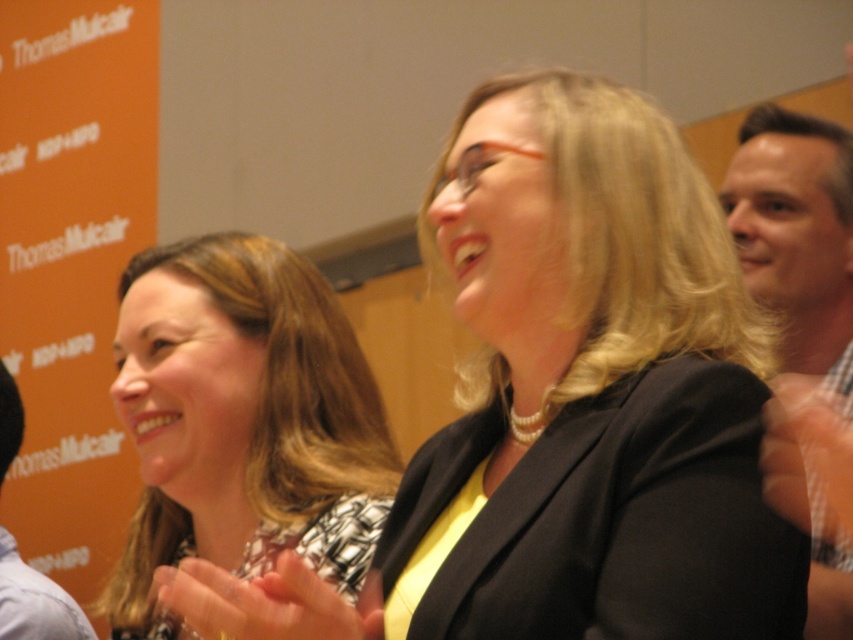
You are a photographer trying to capture a clear shot of the blonde hair at center without the black matte blazer at center blocking it. Is this possible given their positions?

The black matte blazer at center is in front of the blonde hair at center, so it would block the view. Move the camera angle to capture the blonde hair at center without the blazer obstructing it.

You are a photographer trying to capture a closeup of the black matte blazer at center. Based on the scene, can you determine if the blazer is within the camera focus range of 30 inches?

The black matte blazer at center is 33.12 inches from camera, which is slightly beyond the 30 inch focus range, so it may be out of focus.